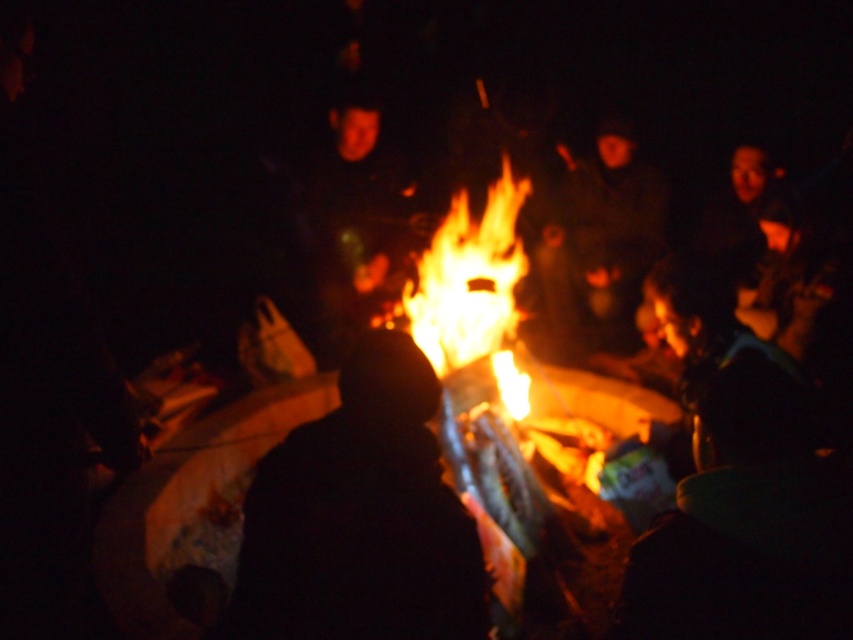
Question: Which point is closer to the camera taking this photo?

Choices:
 (A) (444, 348)
 (B) (251, 524)

Answer: (B)

Question: Which object is farther from the camera taking this photo?

Choices:
 (A) flamematerial/texture at center
 (B) black matte person at center

Answer: (A)

Question: Which object is farther from the camera taking this photo?

Choices:
 (A) black matte person at center
 (B) flamematerial/texture at center

Answer: (B)

Question: Can you confirm if black matte person at center is bigger than flamematerial/texture at center?

Choices:
 (A) no
 (B) yes

Answer: (A)

Question: Is black matte person at center below flamematerial/texture at center?

Choices:
 (A) yes
 (B) no

Answer: (A)

Question: Can you confirm if black matte person at center is positioned below flamematerial/texture at center?

Choices:
 (A) no
 (B) yes

Answer: (B)